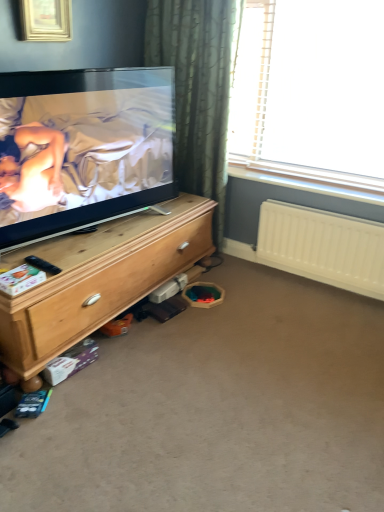
Identify the location of free space above wooden chest of drawers at left (from a real-world perspective). (99, 237).